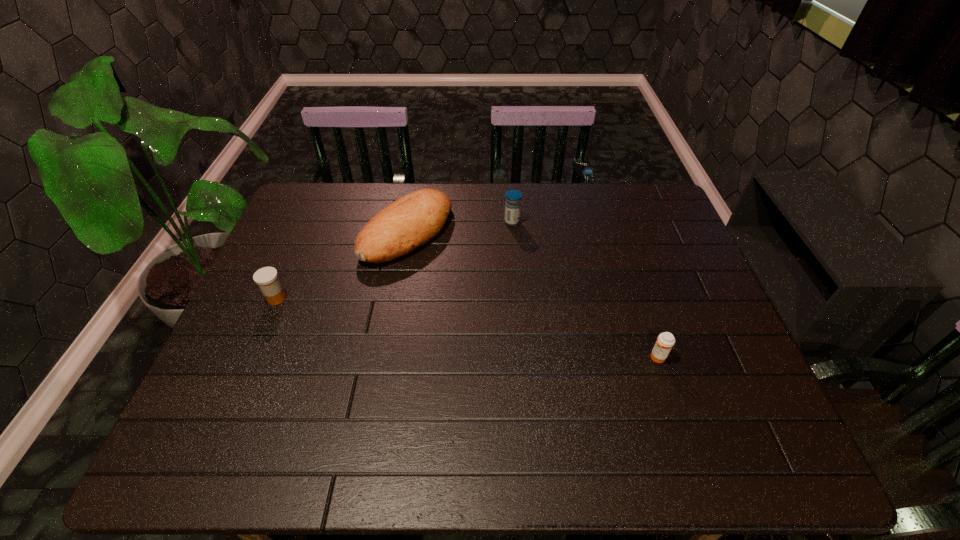
Where is `free region located on the left of the nearest object`? Image resolution: width=960 pixels, height=540 pixels. free region located on the left of the nearest object is located at coordinates click(x=606, y=357).

The height and width of the screenshot is (540, 960). I want to click on medicine present at the far edge, so click(513, 198).

Image resolution: width=960 pixels, height=540 pixels. In order to click on bread that is at the far edge in this screenshot , I will do `click(409, 222)`.

This screenshot has height=540, width=960. Identify the location of object located in the left edge section of the desktop. (267, 277).

In order to click on free location at the far edge in this screenshot , I will do `click(581, 206)`.

At what (x,y) coordinates should I click in order to perform the action: click on vacant space at the near edge. Please return your answer as a coordinate pair (x, y). This screenshot has height=540, width=960. Looking at the image, I should click on (396, 448).

Find the location of a particular element. Image resolution: width=960 pixels, height=540 pixels. free point at the left edge is located at coordinates (242, 340).

The image size is (960, 540). I want to click on vacant region at the right edge of the desktop, so click(x=721, y=400).

Locate an element on the screen. This screenshot has width=960, height=540. free location at the far left corner of the desktop is located at coordinates (332, 226).

Where is `vacant region at the near left corner`? This screenshot has height=540, width=960. vacant region at the near left corner is located at coordinates (176, 448).